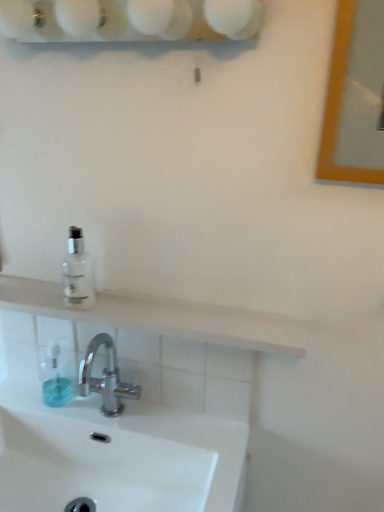
The height and width of the screenshot is (512, 384). I want to click on free spot to the right of transparent plastic soap dispenser at lower left, so click(x=118, y=412).